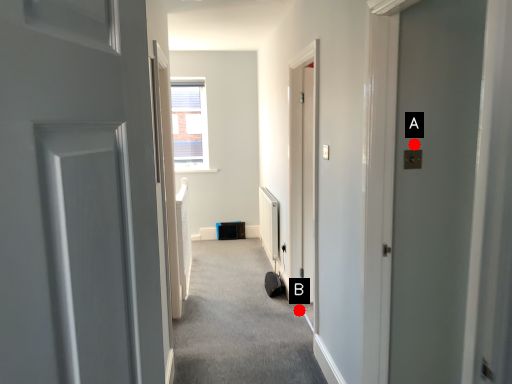
Question: Two points are circled on the image, labeled by A and B beside each circle. Which of the following is the closest to the observer?

Choices:
 (A) A is closer
 (B) B is closer

Answer: (A)